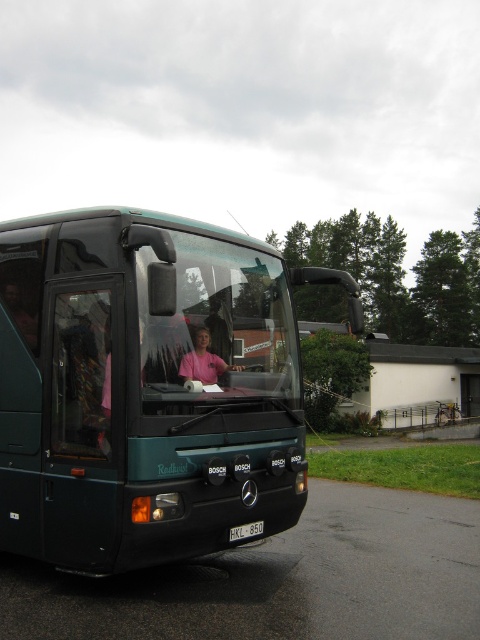
Question: Can you confirm if metallic green bus at center is thinner than pink matte shirt at center?

Choices:
 (A) yes
 (B) no

Answer: (B)

Question: Which of the following is the closest to the observer?

Choices:
 (A) black plastic license plate at center
 (B) metallic green bus at center
 (C) pink matte shirt at center

Answer: (B)

Question: Is pink matte shirt at center positioned before black plastic license plate at center?

Choices:
 (A) no
 (B) yes

Answer: (B)

Question: Is metallic green bus at center smaller than black plastic license plate at center?

Choices:
 (A) yes
 (B) no

Answer: (B)

Question: Which point appears farthest from the camera in this image?

Choices:
 (A) (237, 536)
 (B) (213, 376)

Answer: (B)

Question: Which point is closer to the camera taking this photo?

Choices:
 (A) (249, 525)
 (B) (183, 364)
 (C) (120, 396)

Answer: (C)